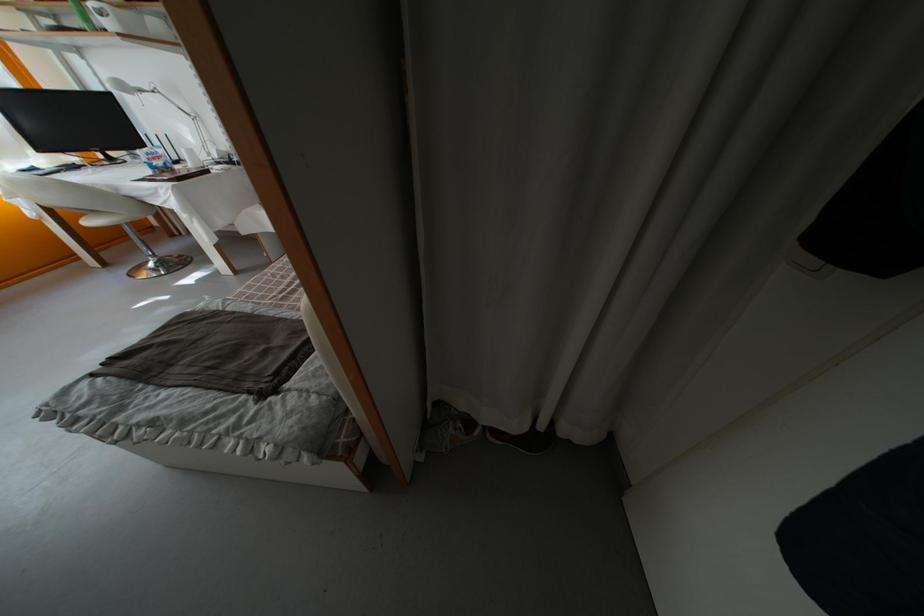
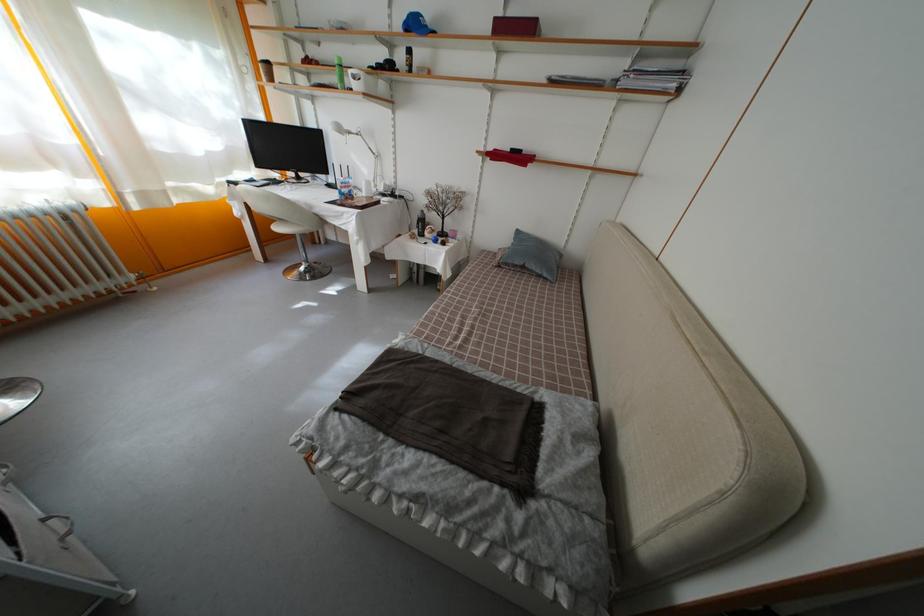
Question: In a continuous first-person perspective shot, in which direction is the camera moving?

Choices:
 (A) Left
 (B) Right
 (C) Forward
 (D) Backward

Answer: (A)